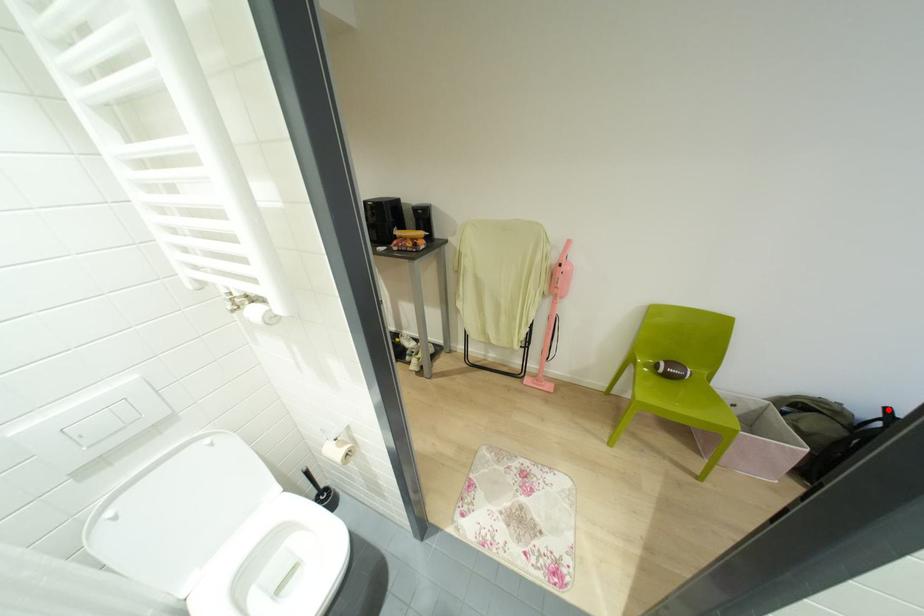
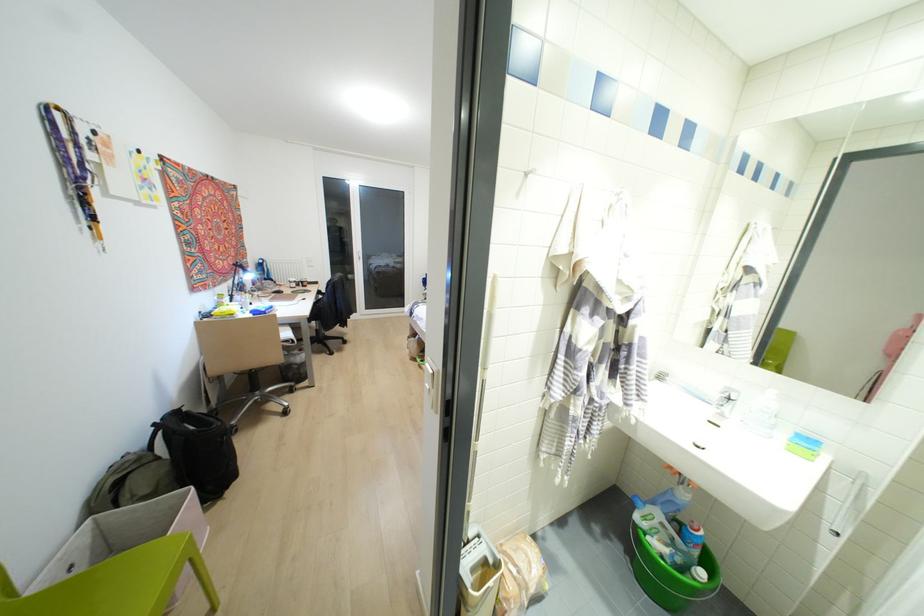
The point at the highlighted location is marked in the first image. Where is the corresponding point in the second image?

(153, 424)